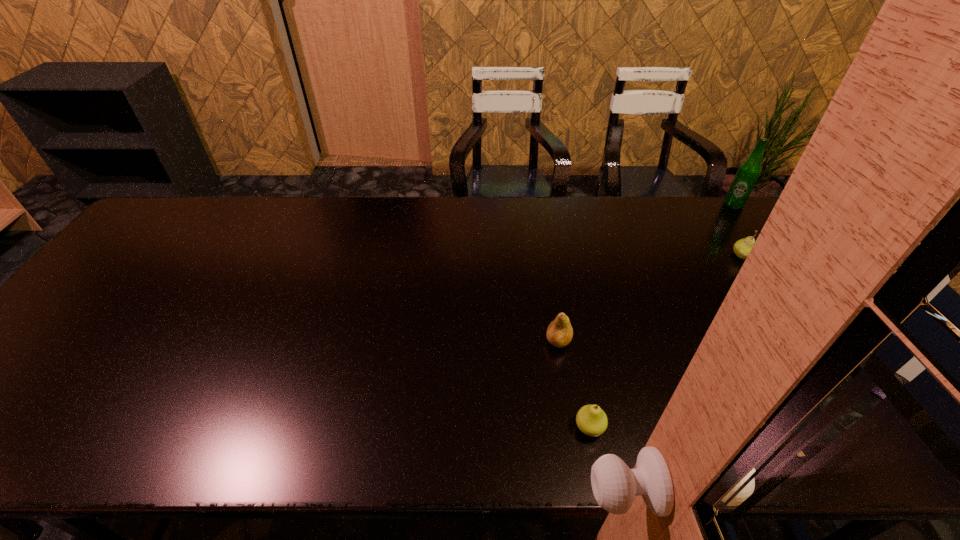
Locate an element on the screen. The image size is (960, 540). free region that satisfies the following two spatial constraints: 1. on the back side of the second farthest pear; 2. on the left side of the third object from left to right is located at coordinates (544, 255).